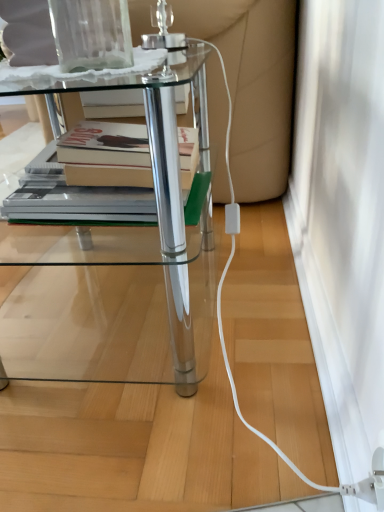
I want to click on clear glass table at center, so click(120, 280).

From the picture: In order to face white matte screen door at lower right, should I rotate leftwards or rightwards?

Turn right approximately 15.068 degrees to face it.

What do you see at coordinates (91, 34) in the screenshot? The image size is (384, 512). I see `transparent glass vase at upper center` at bounding box center [91, 34].

Measure the distance between point [84,22] and camera.

24.72 inches.

Where is `clear glass table at center`? The width and height of the screenshot is (384, 512). clear glass table at center is located at coordinates (120, 280).

Is point (343, 258) more distant than point (3, 230)?

No, it is in front of (3, 230).

Who is shorter, white matte screen door at lower right or clear glass table at center?

Standing shorter between the two is white matte screen door at lower right.

What's the angular difference between white matte screen door at lower right and clear glass table at center's facing directions?

There is a 1.63-degree angle between the facing directions of white matte screen door at lower right and clear glass table at center.

Would you say white matte screen door at lower right is a long distance from clear glass table at center?

That's not correct — white matte screen door at lower right is a little close to clear glass table at center.

Would you say transparent glass vase at upper center is inside or outside white matte screen door at lower right?

transparent glass vase at upper center is outside white matte screen door at lower right.

Is transparent glass vase at upper center positioned with its back to white matte screen door at lower right?

No, transparent glass vase at upper center's orientation is not away from white matte screen door at lower right.

Based on their sizes in the image, would you say transparent glass vase at upper center is bigger or smaller than white matte screen door at lower right?

transparent glass vase at upper center is smaller than white matte screen door at lower right.

Does transparent glass vase at upper center have a lesser height compared to clear glass table at center?

Correct, transparent glass vase at upper center is not as tall as clear glass table at center.

From the picture: Who is smaller, transparent glass vase at upper center or clear glass table at center?

With smaller size is transparent glass vase at upper center.

Based on the photo, considering the positions of objects transparent glass vase at upper center and clear glass table at center in the image provided, who is in front, transparent glass vase at upper center or clear glass table at center?

transparent glass vase at upper center is in front.

Is clear glass table at center a part of transparent glass vase at upper center?

That's incorrect, clear glass table at center is not inside transparent glass vase at upper center.

From a real-world perspective, which object stands above the other?

transparent glass vase at upper center, from a real-world perspective.

In terms of height, does white matte screen door at lower right look taller or shorter compared to transparent glass vase at upper center?

Clearly, white matte screen door at lower right is shorter compared to transparent glass vase at upper center.

How many degrees apart are the facing directions of white matte screen door at lower right and transparent glass vase at upper center?

white matte screen door at lower right and transparent glass vase at upper center are facing 14 degrees away from each other.

Consider the image. Considering the relative positions of white matte screen door at lower right and transparent glass vase at upper center in the image provided, is white matte screen door at lower right to the left or to the right of transparent glass vase at upper center?

Clearly, white matte screen door at lower right is on the right of transparent glass vase at upper center in the image.

Is clear glass table at center turned away from white matte screen door at lower right?

Yes, clear glass table at center is facing away from white matte screen door at lower right.

You are a GUI agent. You are given a task and a screenshot of the screen. Output one action in this format:
    pyautogui.click(x=<x>, y=<y>)
    Task: Click on the table above the white matte screen door at lower right (from a real-world perspective)
    This screenshot has height=512, width=384.
    Given the screenshot: What is the action you would take?
    click(x=120, y=280)

Does point (28, 193) lie in front of point (312, 97)?

Yes, it is in front of point (312, 97).

Could you tell me if clear glass table at center is facing transparent glass vase at upper center?

No, clear glass table at center is not facing towards transparent glass vase at upper center.

Based on the photo, from a real-world perspective, is clear glass table at center physically located above or below transparent glass vase at upper center?

Clearly, from a real-world perspective, clear glass table at center is below transparent glass vase at upper center.

From the image's perspective, does clear glass table at center appear lower than transparent glass vase at upper center?

Yes.

This screenshot has height=512, width=384. Find the location of `screen door behind the clear glass table at center`. screen door behind the clear glass table at center is located at coordinates click(x=342, y=217).

This screenshot has height=512, width=384. Find the location of `glass vase above the white matte screen door at lower right (from a real-world perspective)`. glass vase above the white matte screen door at lower right (from a real-world perspective) is located at coordinates (91, 34).

Based on their spatial positions, is transparent glass vase at upper center or clear glass table at center closer to white matte screen door at lower right?

Based on the image, clear glass table at center appears to be nearer to white matte screen door at lower right.

Which object lies nearer to the anchor point transparent glass vase at upper center, clear glass table at center or white matte screen door at lower right?

clear glass table at center lies closer to transparent glass vase at upper center than the other object.

Considering their positions, is white matte screen door at lower right positioned closer to clear glass table at center than transparent glass vase at upper center?

white matte screen door at lower right is closer to clear glass table at center.

Which object lies further to the anchor point white matte screen door at lower right, clear glass table at center or transparent glass vase at upper center?

transparent glass vase at upper center.

Considering their positions, is transparent glass vase at upper center positioned closer to clear glass table at center than white matte screen door at lower right?

Based on the image, white matte screen door at lower right appears to be nearer to clear glass table at center.

Looking at the image, which one is located closer to transparent glass vase at upper center, white matte screen door at lower right or clear glass table at center?

clear glass table at center is positioned closer to the anchor transparent glass vase at upper center.

The height and width of the screenshot is (512, 384). Identify the location of table located between transparent glass vase at upper center and white matte screen door at lower right in the left-right direction. point(120,280).